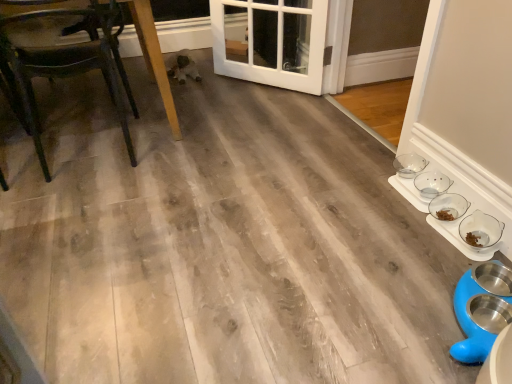
Image resolution: width=512 pixels, height=384 pixels. I want to click on free space in front of clear glass bowl at lower right, which is the first bowl from front to back, so click(x=460, y=247).